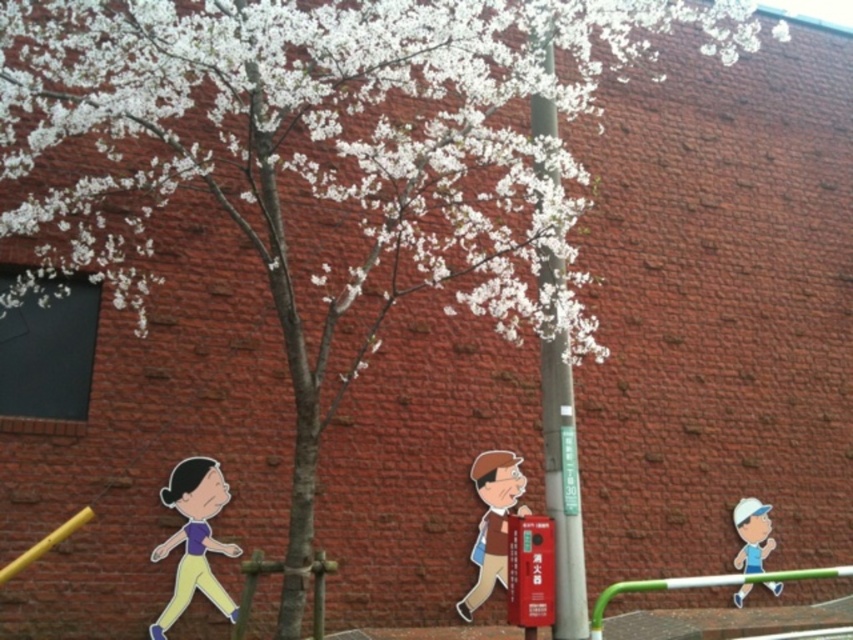
You are a painter standing in front of the urban scene. You need to place a new object between the purple matte shirt at lower left and the brown paper bag at center. Where should you place it?

The purple matte shirt at lower left is to the left of the brown paper bag at center, so you should place the new object between them, to the right of the purple matte shirt at lower left and to the left of the brown paper bag at center.

You are standing in the urban scene looking at the three figures. Which object corresponds to the coordinates point (194, 538)?

The point (194, 538) corresponds to the purple matte shirt at lower left.